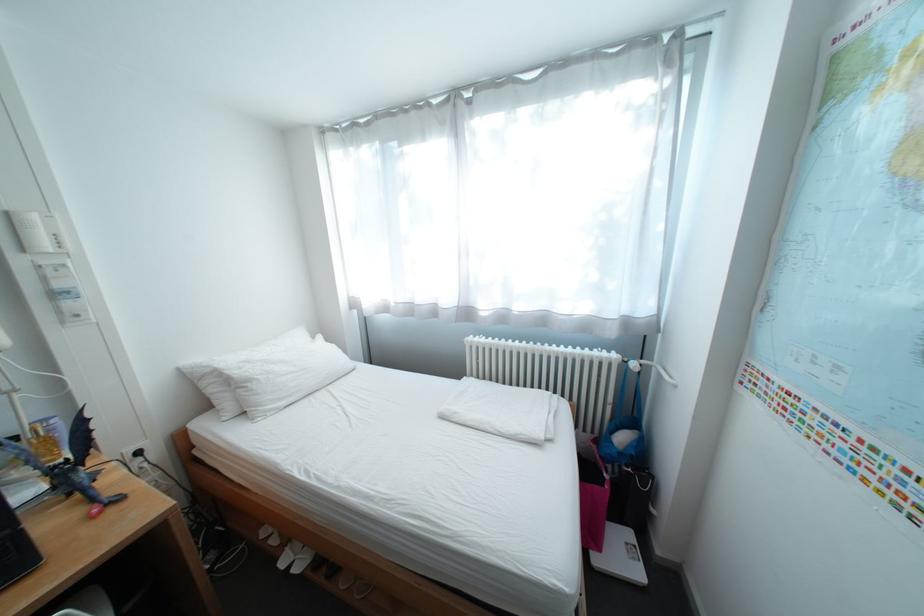
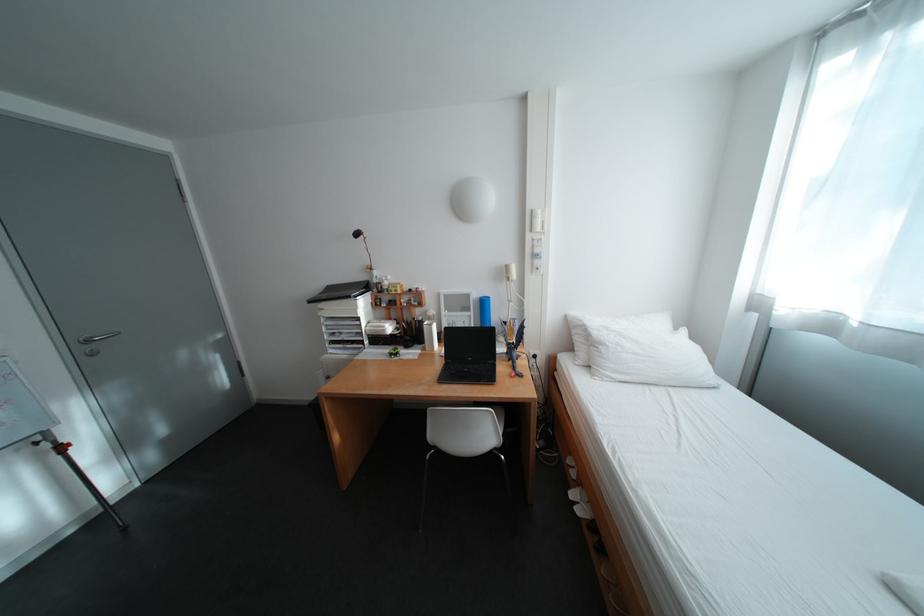
Find the pixel in the second image that matches (31,261) in the first image.

(541, 237)